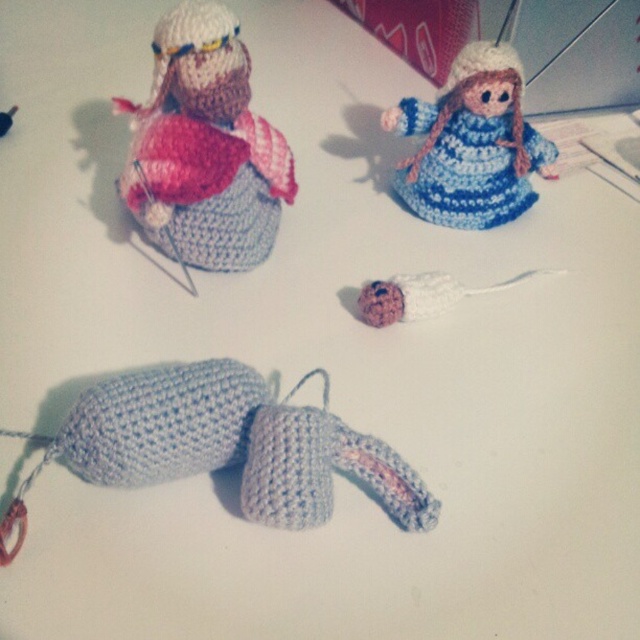
Who is positioned more to the left, light blue yarn toy at center or matte pink yarn doll at upper left?

From the viewer's perspective, matte pink yarn doll at upper left appears more on the left side.

Who is more distant from viewer, (365,460) or (152,147)?

The point (152,147) is behind.

This screenshot has width=640, height=640. In order to click on light blue yarn toy at center in this screenshot , I will do `click(225, 445)`.

Is matte pink yarn doll at upper left shorter than pink yarn ball at center?

No, matte pink yarn doll at upper left is not shorter than pink yarn ball at center.

Between point (179, 19) and point (433, 296), which one is positioned in front?

Point (179, 19) is more forward.

Where is `matte pink yarn doll at upper left`? This screenshot has height=640, width=640. matte pink yarn doll at upper left is located at coordinates (204, 147).

Is point (156, 451) positioned in front of point (483, 209)?

Yes.

Can you confirm if light blue yarn toy at center is positioned above blue yarn doll at upper center?

Actually, light blue yarn toy at center is below blue yarn doll at upper center.

Locate an element on the screen. This screenshot has width=640, height=640. light blue yarn toy at center is located at coordinates (225, 445).